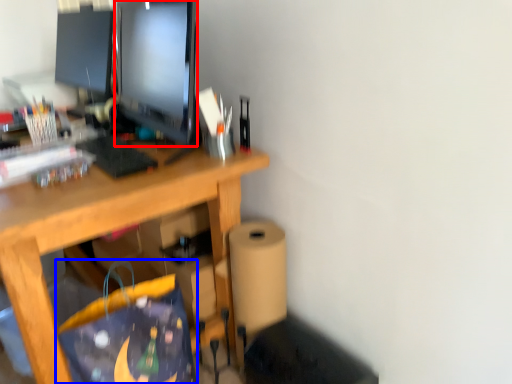
Question: Which of the following is the closest to the observer, television (highlighted by a red box) or shopping bag (highlighted by a blue box)?

Choices:
 (A) television
 (B) shopping bag

Answer: (B)